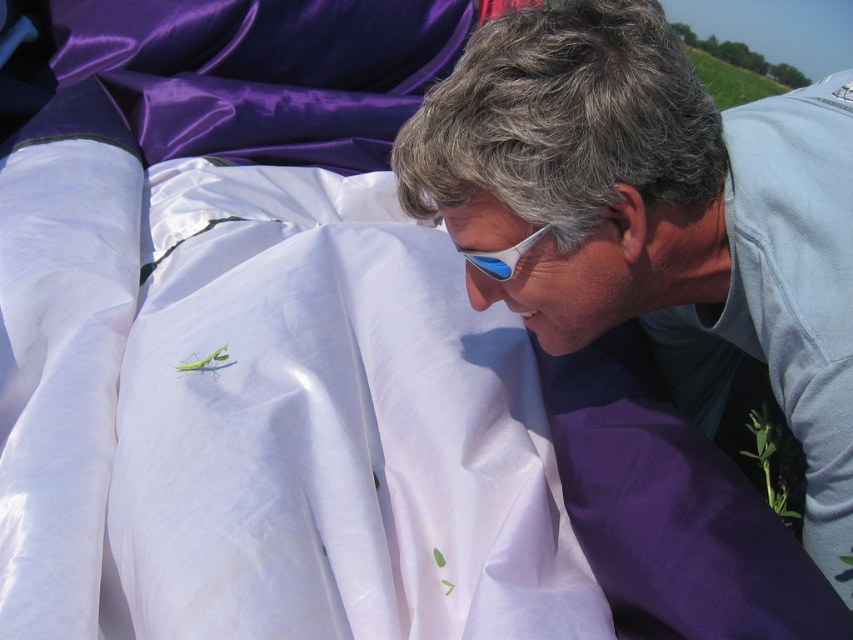
Who is positioned more to the left, matte white shirt at center or white glossy goggles at upper center?

From the viewer's perspective, white glossy goggles at upper center appears more on the left side.

This screenshot has width=853, height=640. Describe the element at coordinates (639, 211) in the screenshot. I see `matte white shirt at center` at that location.

Identify the location of matte white shirt at center. The height and width of the screenshot is (640, 853). (639, 211).

Which is below, white satin blanket at center or white glossy goggles at upper center?

white satin blanket at center is below.

Which of these two, white satin blanket at center or white glossy goggles at upper center, stands shorter?

Standing shorter between the two is white glossy goggles at upper center.

Identify the location of white satin blanket at center. The width and height of the screenshot is (853, 640). (262, 417).

Where is `white satin blanket at center`? This screenshot has height=640, width=853. white satin blanket at center is located at coordinates (262, 417).

Does point (223, 168) come farther from viewer compared to point (807, 518)?

Yes, it is.

This screenshot has height=640, width=853. What do you see at coordinates (262, 417) in the screenshot?
I see `white satin blanket at center` at bounding box center [262, 417].

This screenshot has height=640, width=853. I want to click on white satin blanket at center, so click(x=262, y=417).